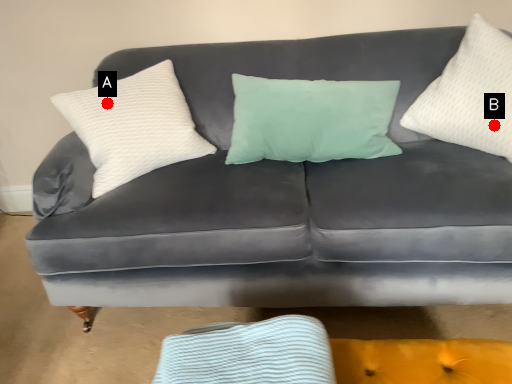
Question: Two points are circled on the image, labeled by A and B beside each circle. Which point appears farthest from the camera in this image?

Choices:
 (A) A is further
 (B) B is further

Answer: (A)